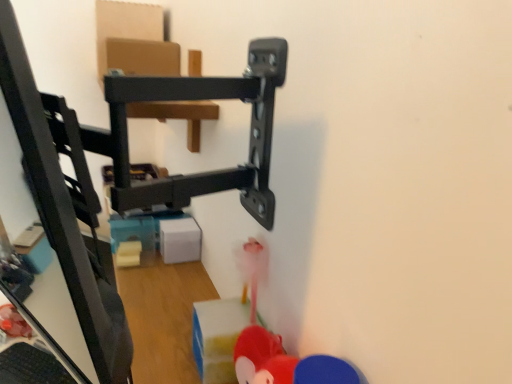
Question: Is translucent plastic toy at lower left, positioned as the 1th toy in left-to-right order, at the left side of rubberized red toy at lower right, which ranks as the first toy in right-to-left order?

Choices:
 (A) no
 (B) yes

Answer: (B)

Question: Does translucent plastic toy at lower left, the 3th toy in the front-to-back sequence, have a smaller size compared to rubberized red toy at lower right, marked as the 3th toy in a back-to-front arrangement?

Choices:
 (A) no
 (B) yes

Answer: (A)

Question: Is translucent plastic toy at lower left, acting as the first toy starting from the back, outside rubberized red toy at lower right, marked as the 3th toy in a back-to-front arrangement?

Choices:
 (A) yes
 (B) no

Answer: (A)

Question: Considering the relative positions of translucent plastic toy at lower left, the 3th toy in the front-to-back sequence, and rubberized red toy at lower right, marked as the 3th toy in a back-to-front arrangement, in the image provided, is translucent plastic toy at lower left, the 3th toy in the front-to-back sequence, to the right of rubberized red toy at lower right, marked as the 3th toy in a back-to-front arrangement, from the viewer's perspective?

Choices:
 (A) yes
 (B) no

Answer: (B)

Question: Are translucent plastic toy at lower left, the 3th toy in the front-to-back sequence, and rubberized red toy at lower right, which ranks as the first toy in right-to-left order, far apart?

Choices:
 (A) no
 (B) yes

Answer: (B)

Question: From a real-world perspective, is translucent plastic toy at lower left, the 3th toy in the front-to-back sequence, on top of rubberized red toy at lower right, the first toy viewed from the front?

Choices:
 (A) yes
 (B) no

Answer: (B)

Question: Is the depth of translucent plastic toy at lower left, acting as the first toy starting from the back, greater than that of rubberized red toy at lower center, acting as the 2th toy starting from the back?

Choices:
 (A) no
 (B) yes

Answer: (B)

Question: Is translucent plastic toy at lower left, positioned as the 1th toy in left-to-right order, with rubberized red toy at lower center, marked as the 2th toy in a front-to-back arrangement?

Choices:
 (A) yes
 (B) no

Answer: (B)

Question: Is translucent plastic toy at lower left, positioned as the 1th toy in left-to-right order, at the left side of rubberized red toy at lower center, the second toy viewed from the left?

Choices:
 (A) no
 (B) yes

Answer: (B)

Question: Is translucent plastic toy at lower left, positioned as the 1th toy in left-to-right order, shorter than rubberized red toy at lower center, acting as the 2th toy starting from the back?

Choices:
 (A) yes
 (B) no

Answer: (A)

Question: Considering the relative sizes of translucent plastic toy at lower left, which ranks as the 3th toy in right-to-left order, and rubberized red toy at lower center, acting as the 2th toy starting from the back, in the image provided, is translucent plastic toy at lower left, which ranks as the 3th toy in right-to-left order, smaller than rubberized red toy at lower center, acting as the 2th toy starting from the back,?

Choices:
 (A) no
 (B) yes

Answer: (A)

Question: Is translucent plastic toy at lower left, which ranks as the 3th toy in right-to-left order, wider than rubberized red toy at lower center, marked as the 2th toy in a front-to-back arrangement?

Choices:
 (A) no
 (B) yes

Answer: (B)

Question: From the image's perspective, is black plastic keyboard at lower left on rubberized red toy at lower center, the second toy viewed from the left?

Choices:
 (A) yes
 (B) no

Answer: (B)